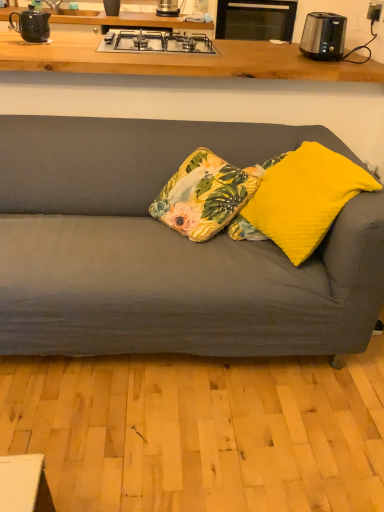
The width and height of the screenshot is (384, 512). Find the location of `free spot to the right of matte black teapot at upper left`. free spot to the right of matte black teapot at upper left is located at coordinates (72, 41).